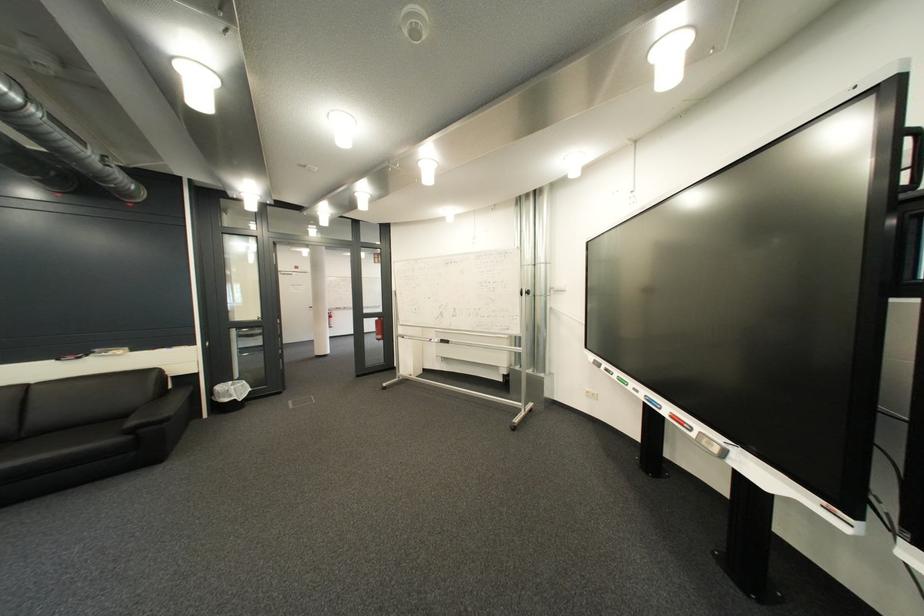
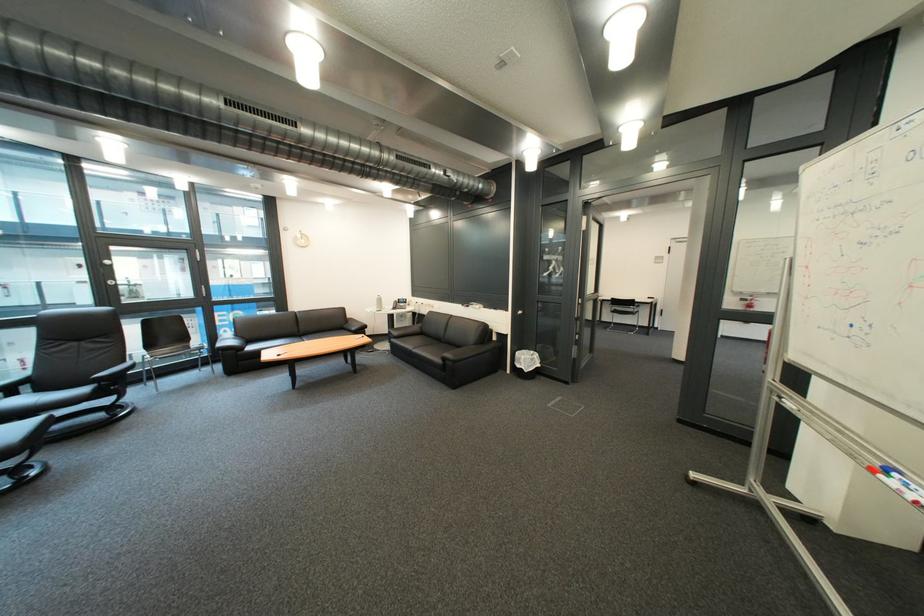
Locate, in the second image, the point that corresponds to [444,341] in the first image.

(901, 472)